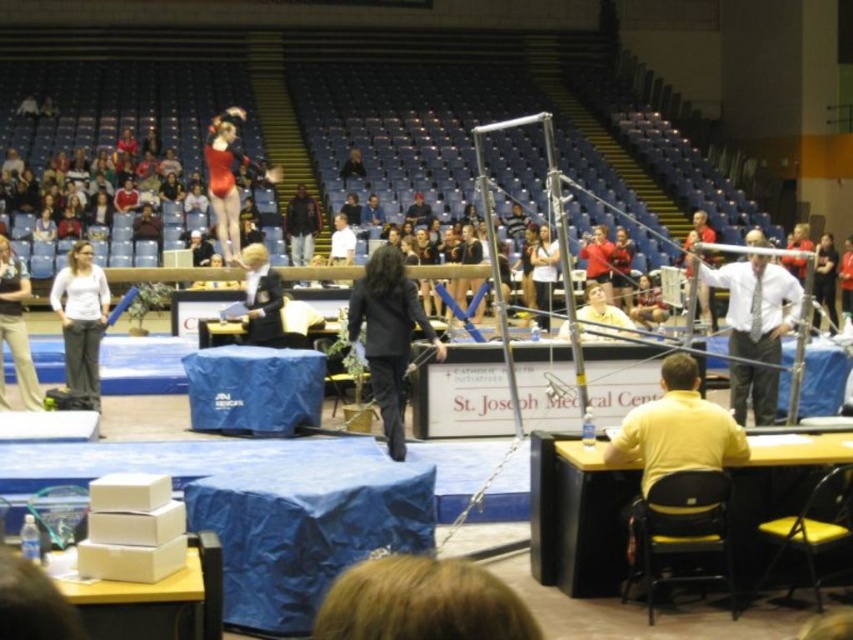
Question: Is the position of black fabric jacket at center less distant than that of light brown hair at upper center?

Choices:
 (A) yes
 (B) no

Answer: (A)

Question: Can you confirm if white soft pants at left is thinner than light brown hair at upper center?

Choices:
 (A) no
 (B) yes

Answer: (A)

Question: Which of the following is the closest to the observer?

Choices:
 (A) (830, 284)
 (B) (759, 340)
 (C) (79, 326)
 (D) (532, 250)

Answer: (B)

Question: Can you confirm if yellow smooth shirt at lower right is thinner than white soft pants at left?

Choices:
 (A) no
 (B) yes

Answer: (A)

Question: Based on their relative distances, which object is nearer to the light brown hair at upper center?

Choices:
 (A) yellow smooth shirt at lower right
 (B) black fabric jacket at center

Answer: (B)

Question: Which point is farther from the camera taking this photo?

Choices:
 (A) (390, 282)
 (B) (816, 246)

Answer: (B)